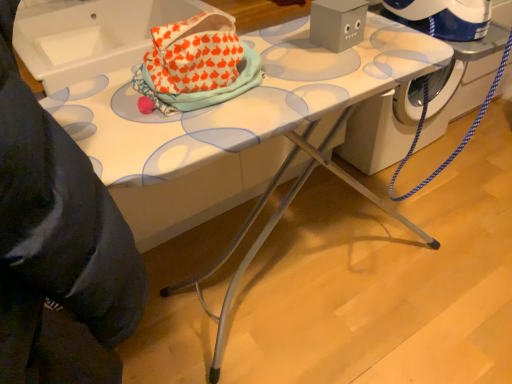
Locate an element on the screen. This screenshot has width=512, height=384. white ceramic sink at upper left is located at coordinates (91, 35).

The height and width of the screenshot is (384, 512). What do you see at coordinates (91, 35) in the screenshot?
I see `white ceramic sink at upper left` at bounding box center [91, 35].

Where is `white plastic washing machine at center`? white plastic washing machine at center is located at coordinates 382,128.

The width and height of the screenshot is (512, 384). Describe the element at coordinates (382, 128) in the screenshot. I see `white plastic washing machine at center` at that location.

Where is `white ceramic sink at upper left`? The height and width of the screenshot is (384, 512). white ceramic sink at upper left is located at coordinates (91, 35).

Does white ceramic sink at upper left appear on the left side of white plastic washing machine at center?

Indeed, white ceramic sink at upper left is positioned on the left side of white plastic washing machine at center.

Is white ceramic sink at upper left behind white plastic washing machine at center?

No, it is in front of white plastic washing machine at center.

Based on the photo, which point is more distant from viewer, (21, 9) or (499, 39)?

Positioned behind is point (21, 9).

From the image's perspective, between white ceramic sink at upper left and white plastic washing machine at center, who is located below?

white plastic washing machine at center appears lower in the image.

From a real-world perspective, which is physically above, white ceramic sink at upper left or white plastic washing machine at center?

white ceramic sink at upper left, from a real-world perspective.

From the picture: Is white ceramic sink at upper left thinner than white plastic washing machine at center?

No, white ceramic sink at upper left is not thinner than white plastic washing machine at center.

Does white ceramic sink at upper left have a lesser height compared to white plastic washing machine at center?

Yes.

Does white ceramic sink at upper left have a larger size compared to white plastic washing machine at center?

No, white ceramic sink at upper left is not bigger than white plastic washing machine at center.

Is white ceramic sink at upper left inside or outside of white plastic washing machine at center?

white ceramic sink at upper left is not enclosed by white plastic washing machine at center.

Would you consider white ceramic sink at upper left to be distant from white plastic washing machine at center?

white ceramic sink at upper left is positioned a significant distance from white plastic washing machine at center.

Could you tell me if white ceramic sink at upper left is turned towards white plastic washing machine at center?

No, white ceramic sink at upper left is not oriented towards white plastic washing machine at center.

You are a GUI agent. You are given a task and a screenshot of the screen. Output one action in this format:
    pyautogui.click(x=<x>, y=<y>)
    Task: Click on the sink above the white plastic washing machine at center (from a real-world perspective)
    Image resolution: width=512 pixels, height=384 pixels.
    Given the screenshot: What is the action you would take?
    pyautogui.click(x=91, y=35)

Is white plastic washing machine at center to the left of white ceramic sink at upper left from the viewer's perspective?

No.

Does white plastic washing machine at center come behind white ceramic sink at upper left?

Yes.

Considering the positions of points (397, 98) and (120, 39), is point (397, 98) farther from camera compared to point (120, 39)?

Yes, point (397, 98) is farther from viewer.

From the image's perspective, is white plastic washing machine at center positioned above or below white ceramic sink at upper left?

From the image's perspective, white plastic washing machine at center appears below white ceramic sink at upper left.

From a real-world perspective, is white plastic washing machine at center positioned over white ceramic sink at upper left based on gravity?

Actually, white plastic washing machine at center is physically below white ceramic sink at upper left in the real world.

Is white plastic washing machine at center thinner than white ceramic sink at upper left?

Indeed, white plastic washing machine at center has a lesser width compared to white ceramic sink at upper left.

Who is taller, white plastic washing machine at center or white ceramic sink at upper left?

Standing taller between the two is white plastic washing machine at center.

Which of these two, white plastic washing machine at center or white ceramic sink at upper left, is bigger?

Bigger between the two is white plastic washing machine at center.

Could white ceramic sink at upper left be considered to be inside white plastic washing machine at center?

No, white ceramic sink at upper left is not inside white plastic washing machine at center.

Can you see white plastic washing machine at center touching white ceramic sink at upper left?

white plastic washing machine at center is not next to white ceramic sink at upper left, and they're not touching.

Is white plastic washing machine at center oriented towards white ceramic sink at upper left?

No.

Can you tell me how much white plastic washing machine at center and white ceramic sink at upper left differ in facing direction?

There is a 1.12-degree angle between the facing directions of white plastic washing machine at center and white ceramic sink at upper left.

At what (x,y) coordinates should I click in order to perform the action: click on sink located on the left of white plastic washing machine at center. Please return your answer as a coordinate pair (x, y). This screenshot has height=384, width=512. Looking at the image, I should click on (91, 35).

Locate an element on the screen. Image resolution: width=512 pixels, height=384 pixels. sink that appears above the white plastic washing machine at center (from a real-world perspective) is located at coordinates (91, 35).

Identify the location of sink in front of the white plastic washing machine at center. (91, 35).